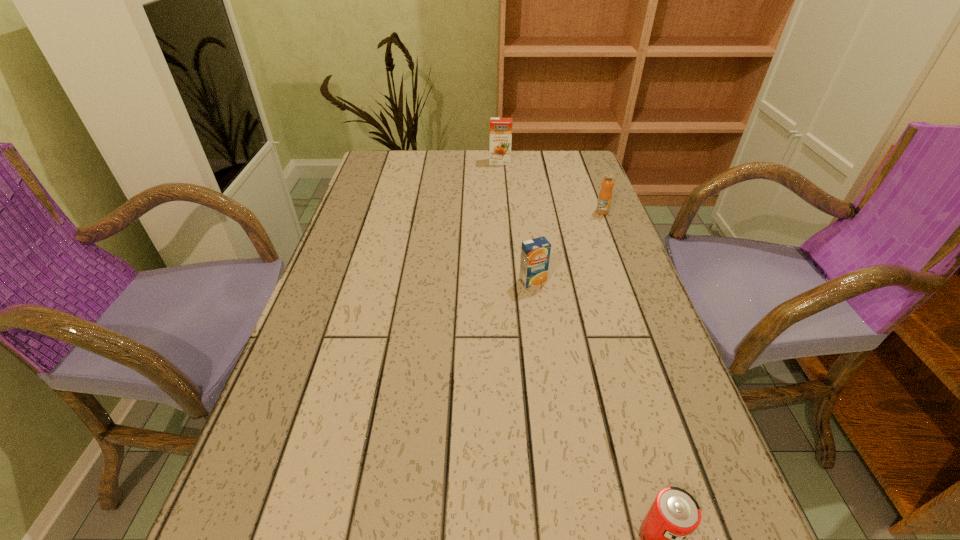
You are a GUI agent. You are given a task and a screenshot of the screen. Output one action in this format:
    pyautogui.click(x=<x>, y=<y>)
    Task: Click on the object identified as the closest to the second nearest orange_juice
    Image resolution: width=960 pixels, height=540 pixels.
    Given the screenshot: What is the action you would take?
    pyautogui.click(x=535, y=254)

Select which object is the second closest to the can. Please provide its 2D coordinates. Your answer should be formatted as a tuple, i.e. [(x, y)], where the tuple contains the x and y coordinates of a point satisfying the conditions above.

[(605, 195)]

Select which orange_juice is the second closest to the rightmost object. Please provide its 2D coordinates. Your answer should be formatted as a tuple, i.e. [(x, y)], where the tuple contains the x and y coordinates of a point satisfying the conditions above.

[(500, 128)]

Choose which orange_juice is the second nearest neighbor to the second object from right to left. Please provide its 2D coordinates. Your answer should be formatted as a tuple, i.e. [(x, y)], where the tuple contains the x and y coordinates of a point satisfying the conditions above.

[(605, 195)]